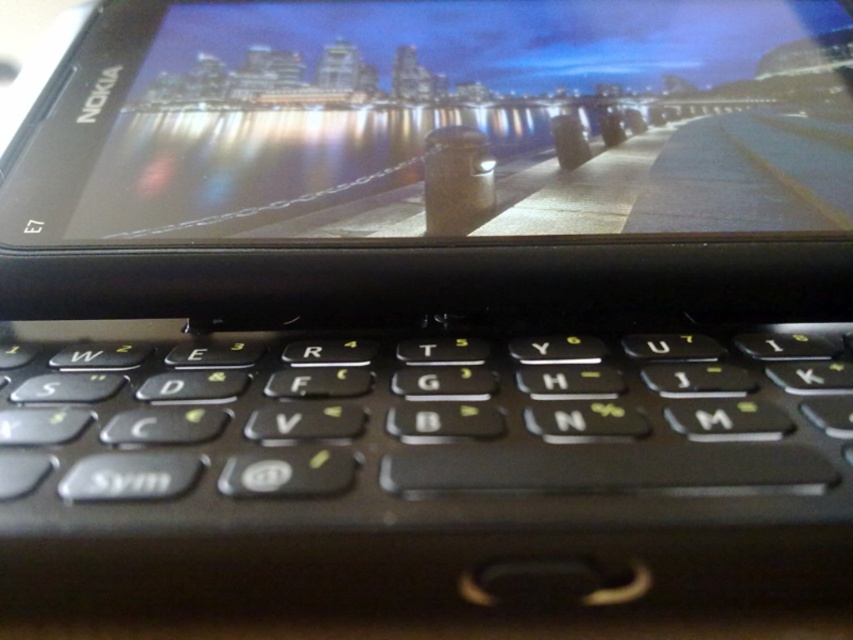
Question: Among these objects, which one is farthest from the camera?

Choices:
 (A) black plastic keyboard at center
 (B) matte black screen at upper center

Answer: (B)

Question: Does black plastic keyboard at center appear under matte black screen at upper center?

Choices:
 (A) no
 (B) yes

Answer: (B)

Question: Among these points, which one is farthest from the camera?

Choices:
 (A) [79, 193]
 (B) [664, 344]

Answer: (A)

Question: Can you confirm if black plastic keyboard at center is bigger than matte black screen at upper center?

Choices:
 (A) no
 (B) yes

Answer: (A)

Question: Does black plastic keyboard at center appear over matte black screen at upper center?

Choices:
 (A) no
 (B) yes

Answer: (A)

Question: Which point is closer to the camera?

Choices:
 (A) (151, 44)
 (B) (715, 404)

Answer: (B)